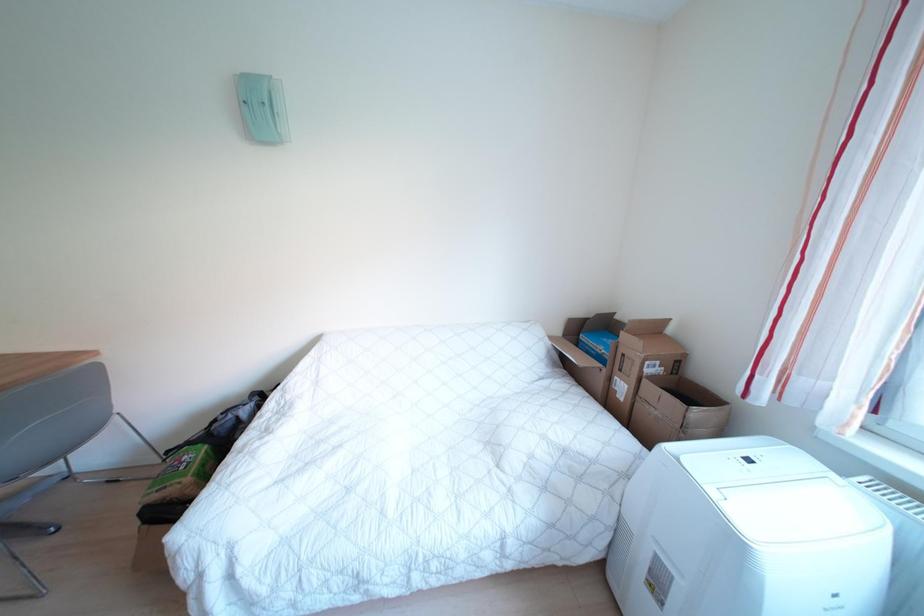
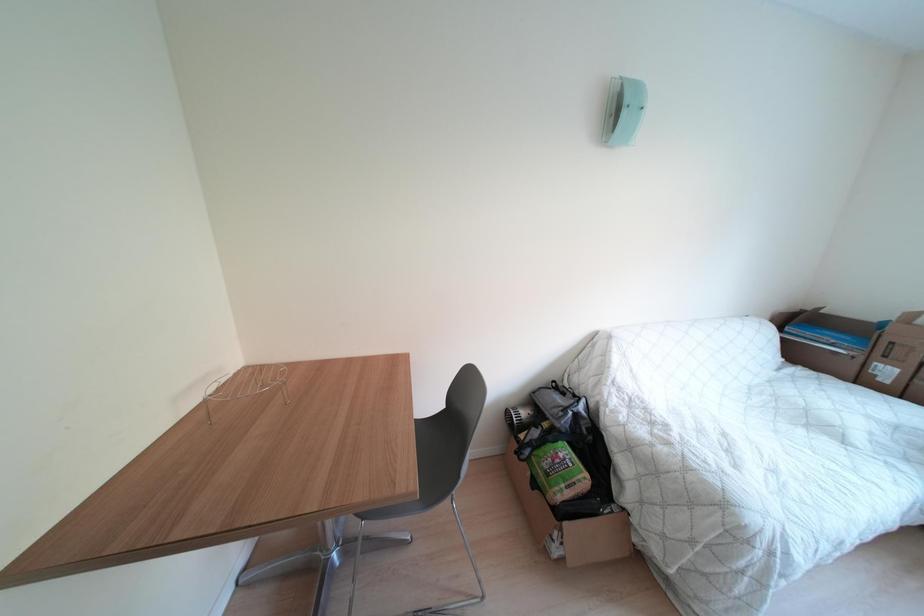
Question: In a continuous first-person perspective shot, in which direction is the camera moving?

Choices:
 (A) Left
 (B) Right
 (C) Forward
 (D) Backward

Answer: (A)